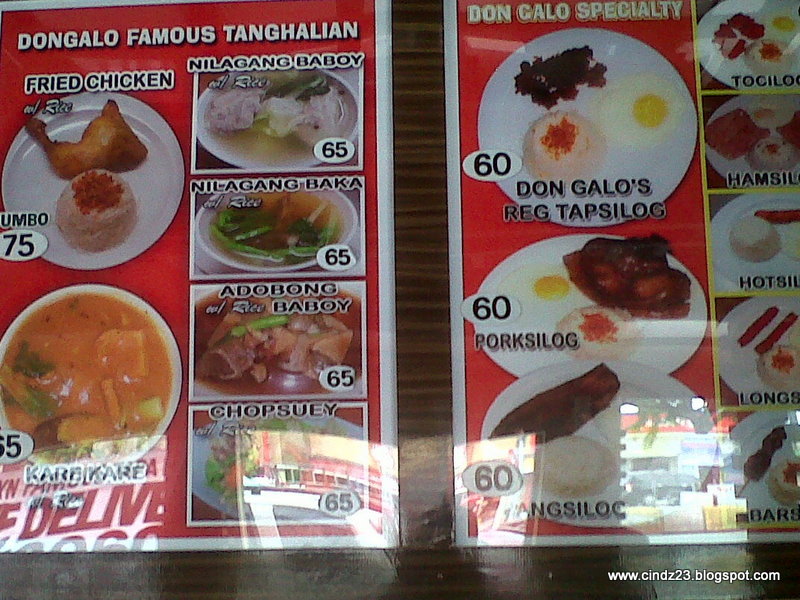
I want to click on wood table, so click(x=422, y=255).